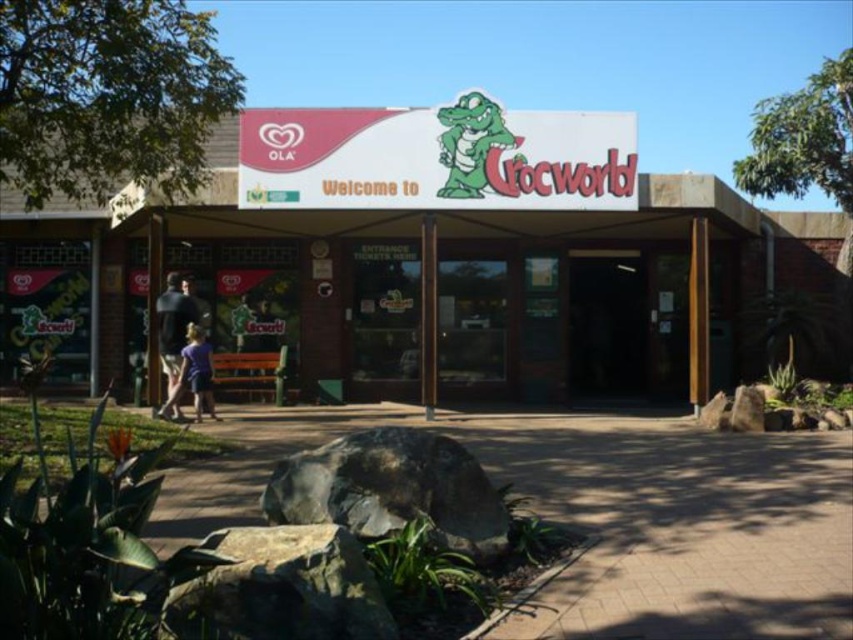
You are standing at the entrance of Crocworld and need to locate two specific points marked on the ground. The first point is at coordinate point (x=747, y=241) and the second is at point (x=173, y=403). From your current position, which point is closer to you?

Point (x=173, y=403) is closer to you because it is in front of point (x=747, y=241), which is behind it.

You are standing at the entrance of Crocworld and want to find the nearest point to the entrance. There are two points marked as point (434, 141) and point (619, 355). Which point is closer to the entrance?

Point (434, 141) is in front of point (619, 355), so it is closer to the entrance.